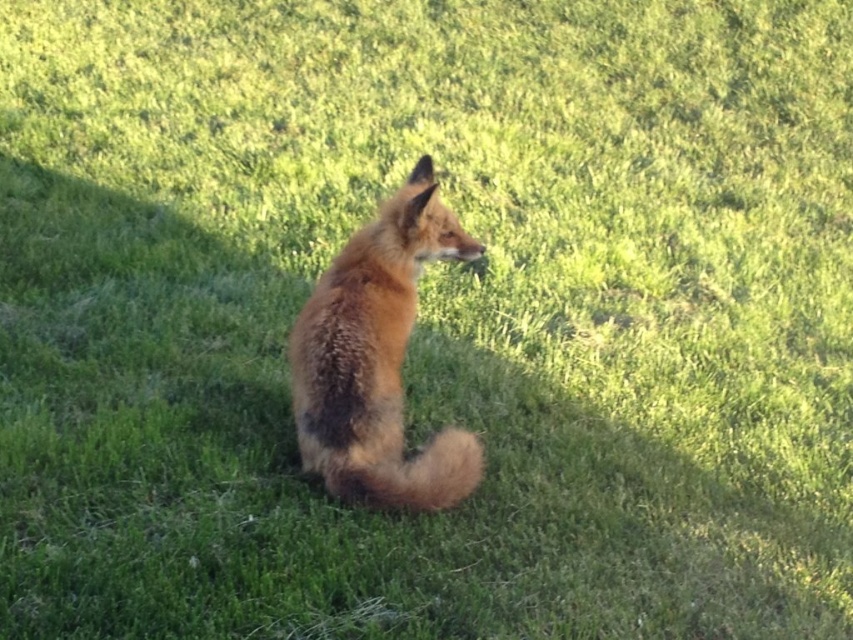
Question: Which of the following is the farthest from the observer?

Choices:
 (A) (397, 460)
 (B) (370, 416)

Answer: (A)

Question: Which object appears farthest from the camera in this image?

Choices:
 (A) fluffy brown tail at center
 (B) fluffy reddish-brown fox at center

Answer: (B)

Question: Observing the image, what is the correct spatial positioning of fluffy reddish-brown fox at center in reference to fluffy brown tail at center?

Choices:
 (A) left
 (B) right

Answer: (A)

Question: Does fluffy reddish-brown fox at center have a greater width compared to fluffy brown tail at center?

Choices:
 (A) no
 (B) yes

Answer: (B)

Question: Does fluffy reddish-brown fox at center have a larger size compared to fluffy brown tail at center?

Choices:
 (A) yes
 (B) no

Answer: (A)

Question: Which point is farther to the camera?

Choices:
 (A) (453, 435)
 (B) (437, 502)

Answer: (A)